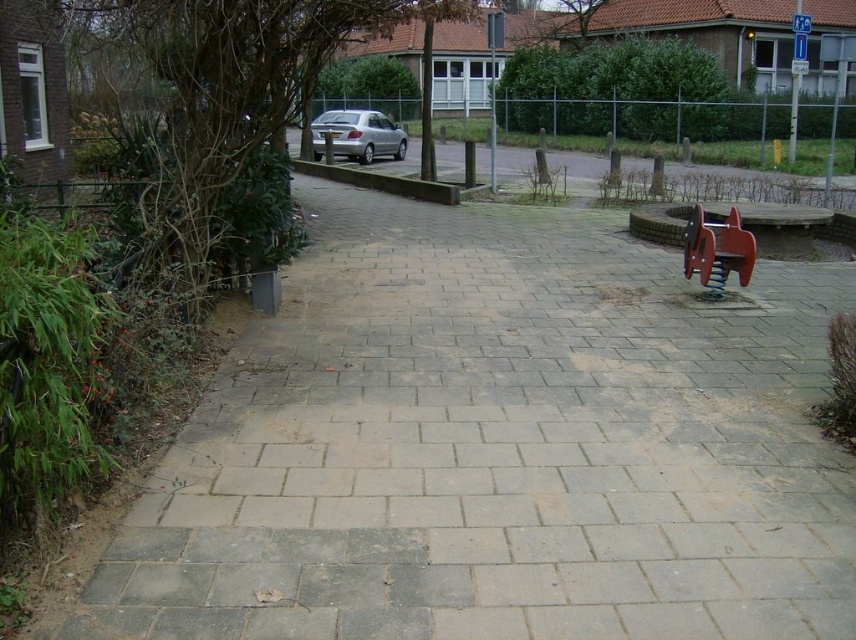
You are a parent trying to decide whether to let your child play on the metallic red swing set at right while the silver metallic car at center is parked nearby. Considering their heights, which one is taller?

The silver metallic car at center is taller than the metallic red swing set at right.

You are a delivery person trying to avoid stepping on the gray concrete pavement at left. You need to walk towards the silver metallic car at center. Which direction should you move to avoid the pavement?

To avoid the gray concrete pavement at left, you should move towards the silver metallic car at center, as the pavement is lower in height compared to the car, so stepping towards the car would mean moving to higher ground.

You are a delivery person trying to navigate through the pathway. You need to deliver a package to the fenced area ahead. The swing set and the car are in your way. Which object, the metallic red swing set at right or the silver metallic car at center, is closer to you as you stand on the pathway?

The metallic red swing set at right is closer to you because it is in front of the silver metallic car at center, meaning it is nearer to your current position on the pathway.